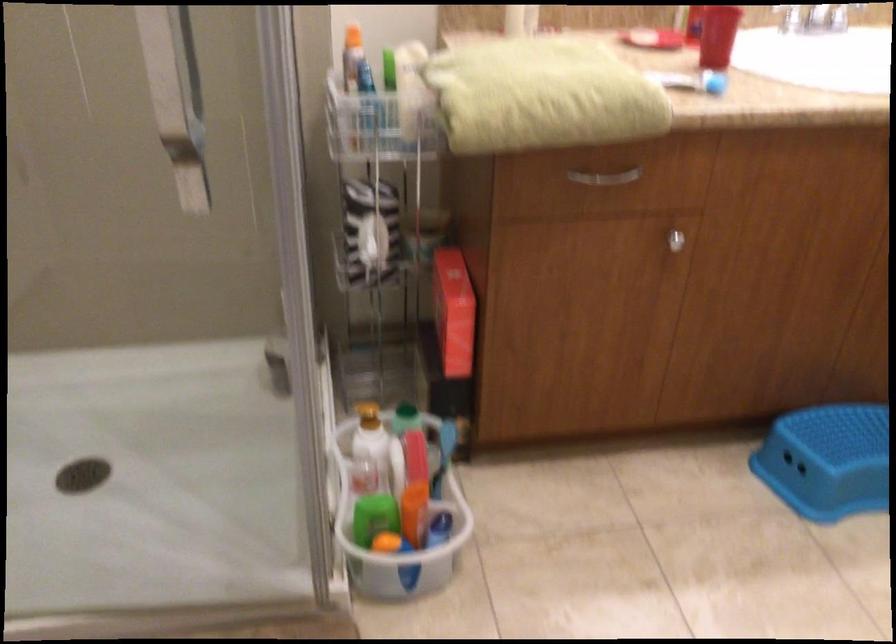
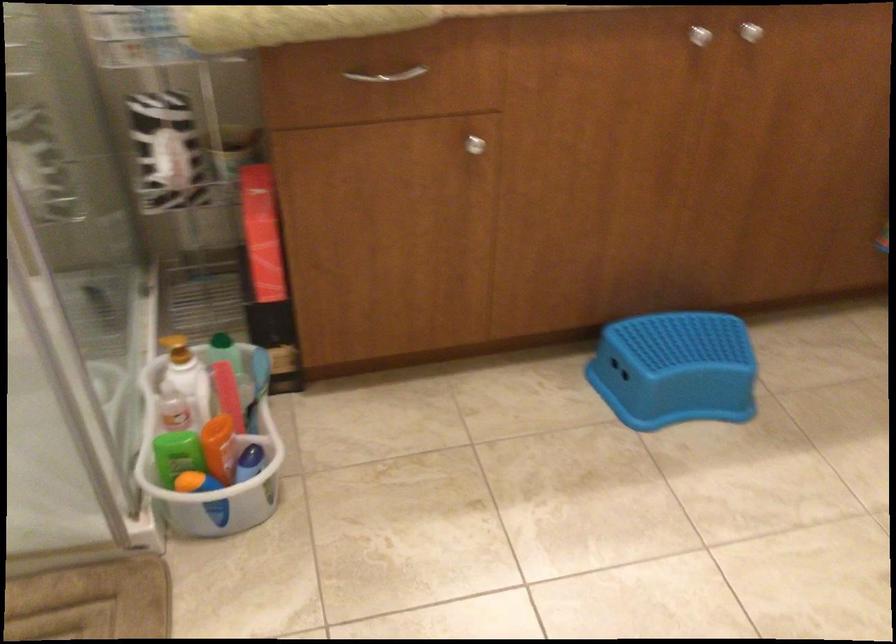
Find the pixel in the second image that matches (601,172) in the first image.

(386, 75)